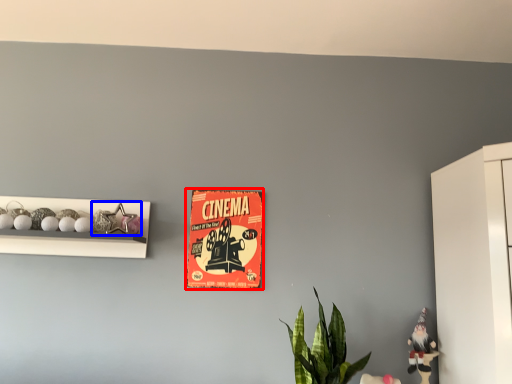
Question: Which object appears farthest to the camera in this image, postcard (highlighted by a red box) or toy (highlighted by a blue box)?

Choices:
 (A) postcard
 (B) toy

Answer: (A)